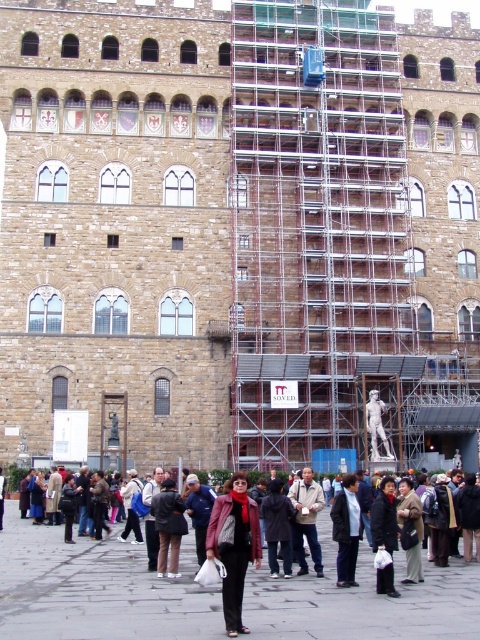
You are a photographer trying to capture a shot of the historic stone building with its scaffolding. You notice two jackets in the foreground that might obstruct your view. Which jacket should you move to the right to ensure the light brown leather jacket at center remains centered in your frame?

The leather jacket at center should be moved to the right because it is currently on the left side of the light brown leather jacket at center, so moving it would allow the light brown leather jacket at center to stay centered while keeping the historic stone building visible.